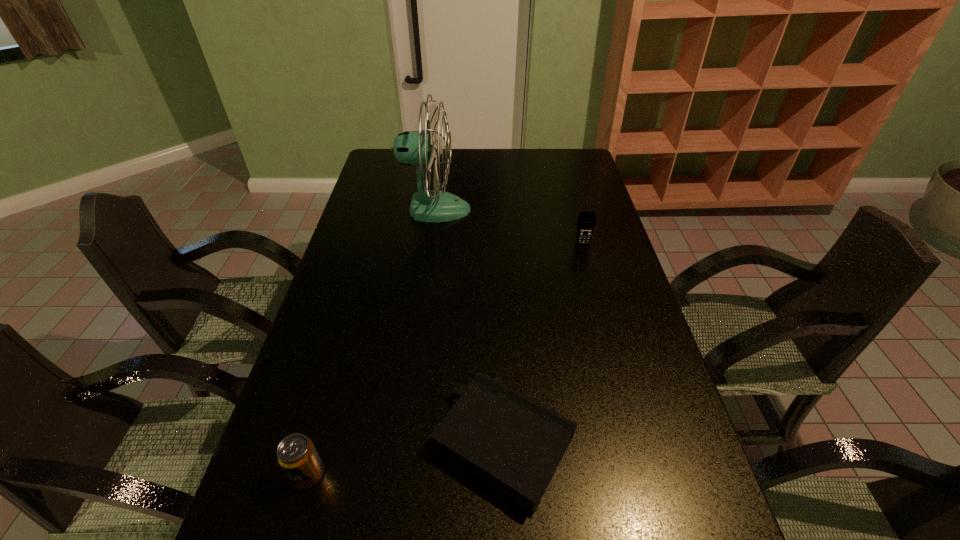
This screenshot has width=960, height=540. Find the location of `blank area in the image that satisfies the following two spatial constraints: 1. in front of the tallest object, directing airflow; 2. on the back side of the shortest object`. blank area in the image that satisfies the following two spatial constraints: 1. in front of the tallest object, directing airflow; 2. on the back side of the shortest object is located at coordinates (404, 442).